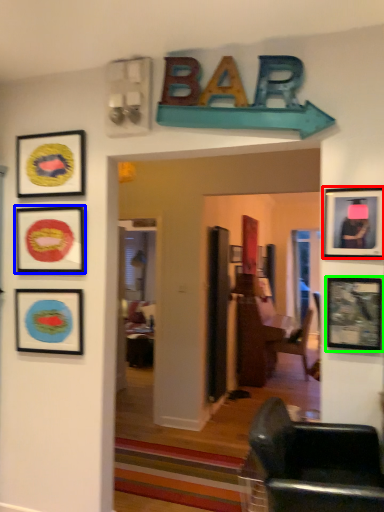
Question: Estimate the real-world distances between objects in this image. Which object is farther from picture frame (highlighted by a red box), picture frame (highlighted by a blue box) or picture frame (highlighted by a green box)?

Choices:
 (A) picture frame
 (B) picture frame

Answer: (A)